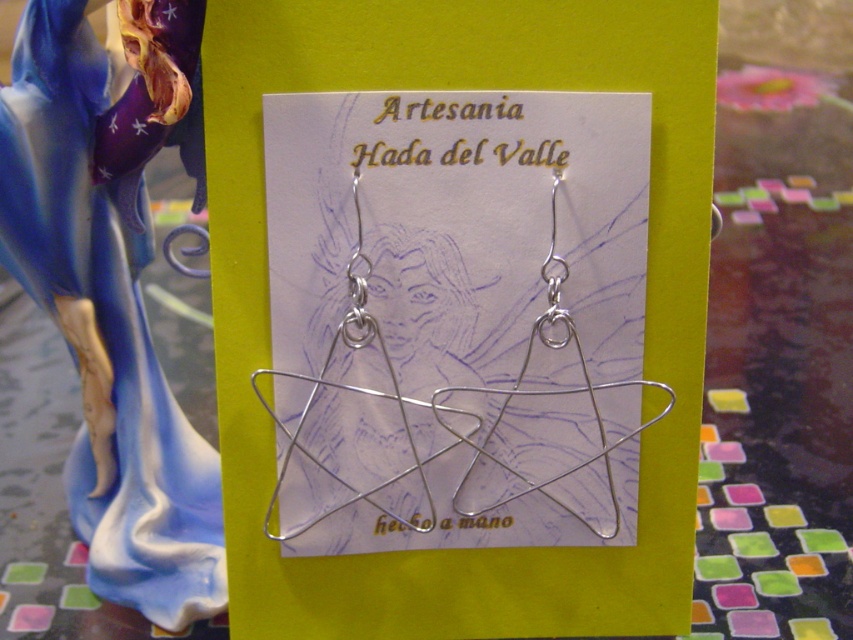
Does matte porcelain figure at left have a larger size compared to silver wire star at center?

Correct, matte porcelain figure at left is larger in size than silver wire star at center.

At what (x,y) coordinates should I click in order to perform the action: click on matte porcelain figure at left. Please return your answer as a coordinate pair (x, y). Looking at the image, I should click on (105, 324).

You are a GUI agent. You are given a task and a screenshot of the screen. Output one action in this format:
    pyautogui.click(x=<x>, y=<y>)
    Task: Click on the matte porcelain figure at left
    The image size is (853, 640).
    Given the screenshot: What is the action you would take?
    pyautogui.click(x=105, y=324)